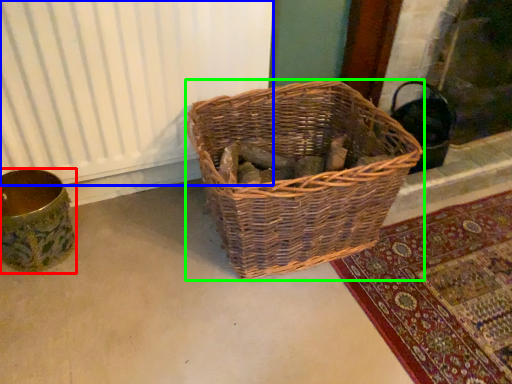
Question: Considering the real-world distances, which object is farthest from flower basket (highlighted by a red box)? radiator (highlighted by a blue box) or picnic basket (highlighted by a green box)?

Choices:
 (A) radiator
 (B) picnic basket

Answer: (B)